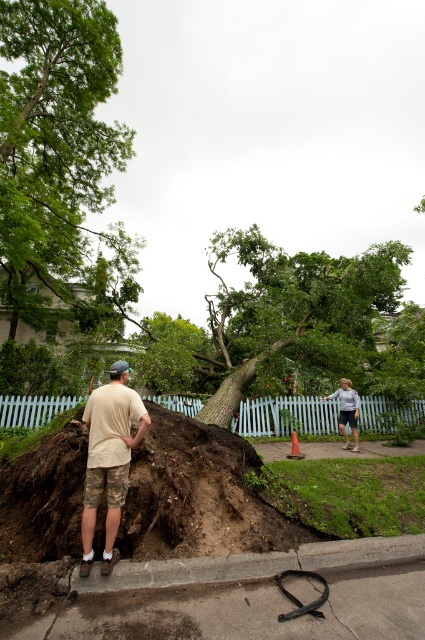
You are a delivery person trying to reach the front door of the house. You see the green leafy tree at upper left and the smooth concrete sidewalk at lower center. Which object is closer to the house?

The smooth concrete sidewalk at lower center is closer to the house because it is located below the green leafy tree at upper left.

You are a delivery person who needs to place a package on the ground near the smooth concrete sidewalk at lower center and the gray concrete curb at lower center. The package requires a flat surface that is at least 14 inches wide. Can you place the package between these two objects?

The smooth concrete sidewalk at lower center is 13.60 inches from the gray concrete curb at lower center. Since the required width is 14 inches, the space between them is slightly too narrow, so the package cannot be placed there.